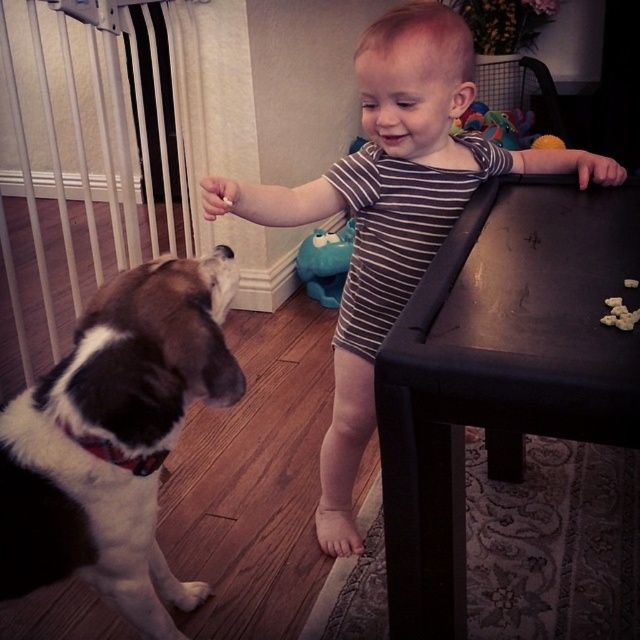
Does point (468, 113) lie in front of point (616, 305)?

No.

This screenshot has width=640, height=640. I want to click on plush blue elephant at upper center, so click(504, 128).

Which is more to the right, brown and white fur at left or striped cotton onesie at center?

striped cotton onesie at center is more to the right.

Is brown and white fur at left wider than striped cotton onesie at center?

In fact, brown and white fur at left might be narrower than striped cotton onesie at center.

Is point (52, 580) more distant than point (381, 236)?

No, (52, 580) is closer to viewer.

The width and height of the screenshot is (640, 640). Find the location of `brown and white fur at left`. brown and white fur at left is located at coordinates (115, 436).

Does point (6, 538) come closer to viewer compared to point (324, 244)?

Yes, it is.

Who is positioned more to the left, brown and white fur at left or matte blue plush toy at center?

brown and white fur at left

Does point (147, 564) come behind point (308, 243)?

No, it is in front of (308, 243).

The image size is (640, 640). What are the coordinates of `brown and white fur at left` in the screenshot? It's located at (115, 436).